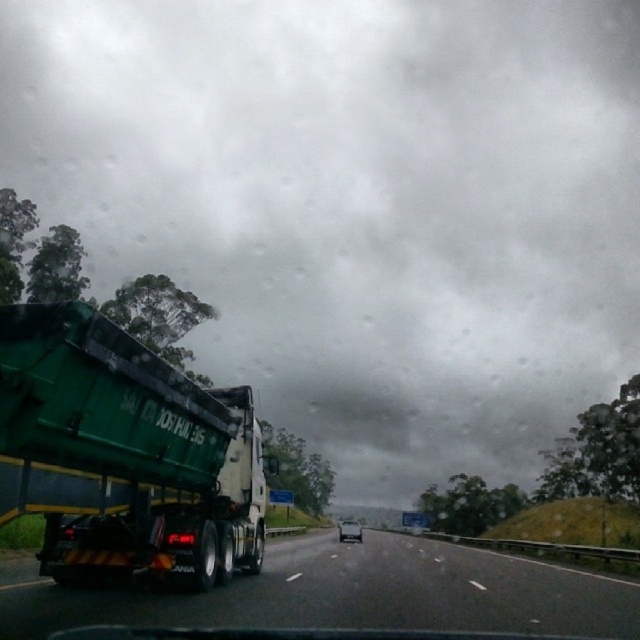
You are driving a metallic silver sedan at center and want to overtake the green rubber truck at left. The road ahead is straight for the next 100 meters. Can you safely overtake the truck within the next 100 meters if your car can accelerate to 120 kmph and the truck is moving at 60 kmph?

The distance between the green rubber truck at left and the metallic silver sedan at center is 62.07 meters. To safely overtake, the sedan needs enough space to accelerate past the truck without cutting off. Given the speed difference of 60 kmph, the sedan can cover the 100 meters in about 4.6 seconds. The truck would move forward approximately 23 meters in that time. The total required space would be 62.07 meters plus 23 meters, totaling 85.07 meters. Since the road ahead is straight for 100 meters, there

You are a delivery driver who needs to pass a green matte truck at left and a green rubber truck at left on a narrow road. Which truck should you pass first to minimize the space needed?

You should pass the green matte truck at left first since it occupies less space than the green rubber truck at left, requiring less room to maneuver around.